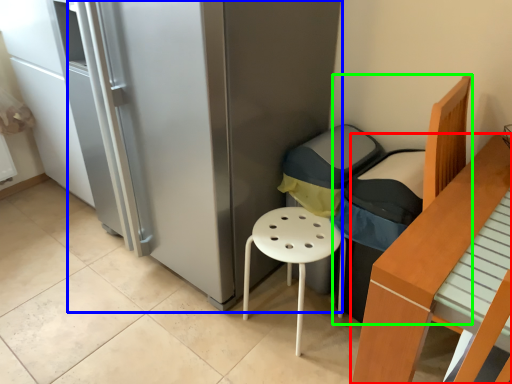
Question: Based on their relative distances, which object is nearer to furniture (highlighted by a red box)? Choose from fridge (highlighted by a blue box) and armchair (highlighted by a green box).

Choices:
 (A) fridge
 (B) armchair

Answer: (B)